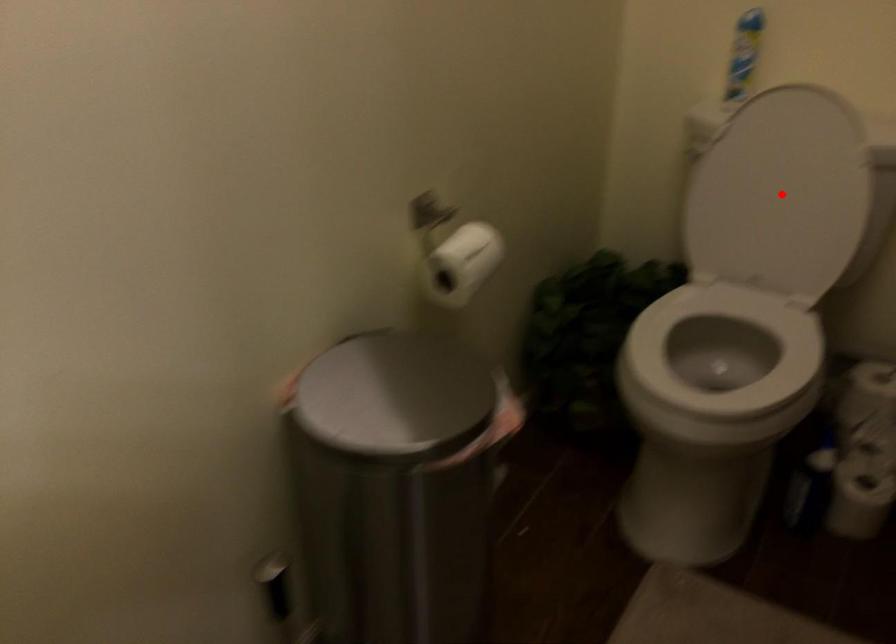
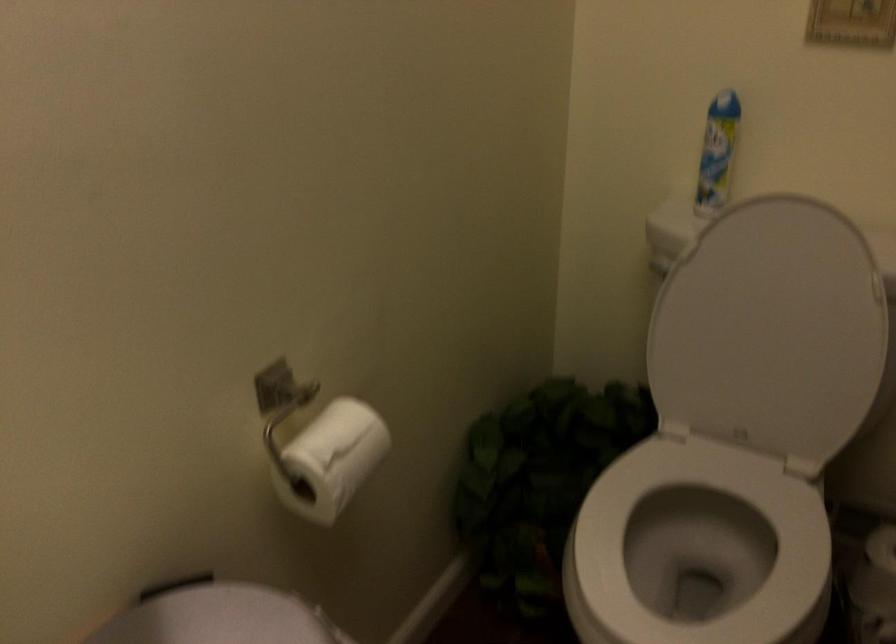
The point at the highlighted location is marked in the first image. Where is the corresponding point in the second image?

(771, 330)